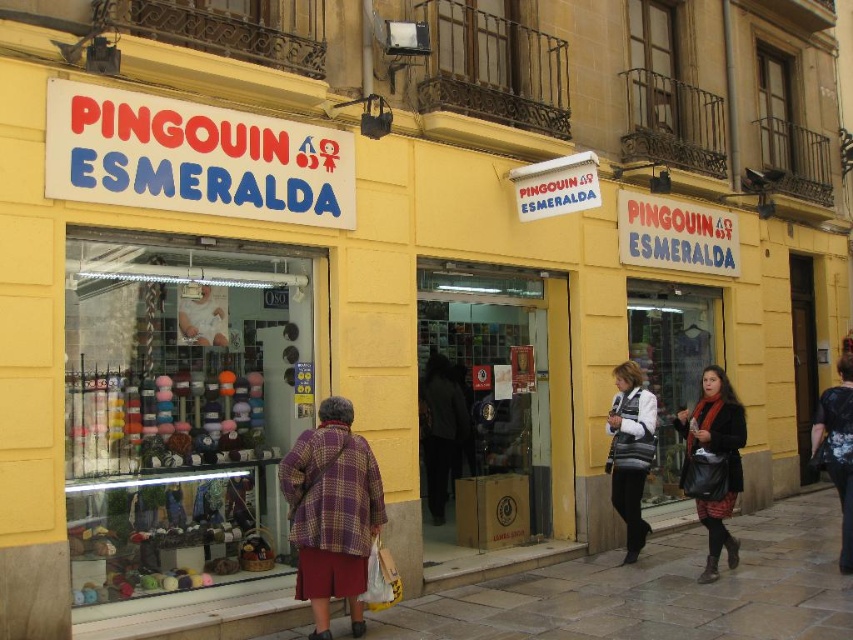
Question: Which of the following is the farthest from the observer?

Choices:
 (A) transparent glass shop window at center
 (B) multicolored yarns at left
 (C) clear glass door at center
 (D) striped sweater at center

Answer: (A)

Question: Can you confirm if clear glass door at center is positioned below matte black jacket at lower right?

Choices:
 (A) yes
 (B) no

Answer: (B)

Question: Which point is farther to the camera?

Choices:
 (A) (675, 472)
 (B) (642, 394)
 (C) (296, 580)

Answer: (A)

Question: Which is nearer to the matte black jacket at lower right?

Choices:
 (A) plaid wool coat at center
 (B) striped sweater at center
 (C) transparent glass shop window at center
 (D) multicolored yarns at left

Answer: (B)

Question: Can you confirm if plaid wool coat at center is bigger than matte black jacket at lower right?

Choices:
 (A) yes
 (B) no

Answer: (B)

Question: Is transparent glass shop window at center to the left of matte black jacket at lower right from the viewer's perspective?

Choices:
 (A) no
 (B) yes

Answer: (A)